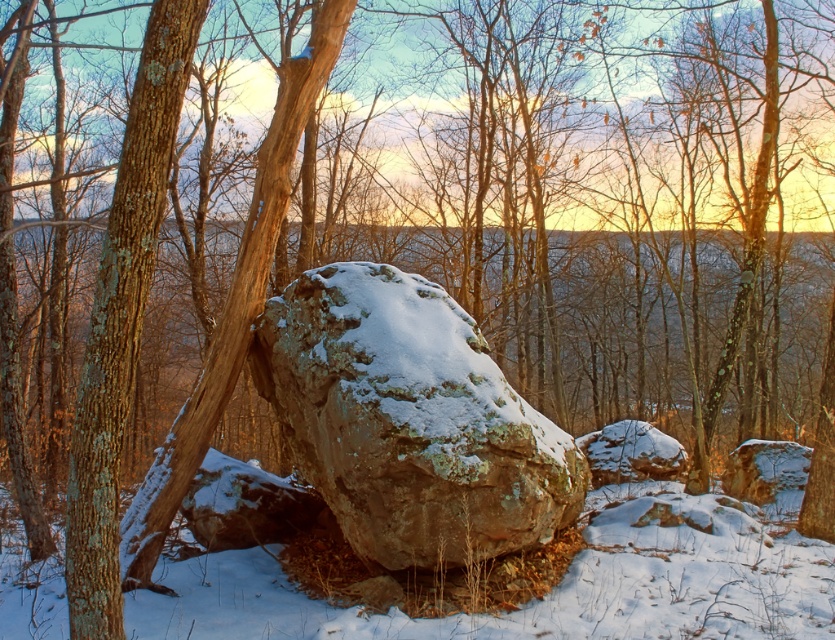
You are an explorer standing in the winter landscape and want to reach the smooth brown tree trunk at left. Which direction should you move relative to the snowy gray rock at center?

You should move away from the snowy gray rock at center towards the smooth brown tree trunk at left because the tree trunk is further away from you than the rock.

You are an outdoor photographer planning to take a photo of the snowy gray rock at center and the smooth brown tree trunk at left. You want to ensure both subjects are in focus. If your camera has a depth of field that can cover 3 meters, will both subjects be in focus?

The snowy gray rock at center is 2.85 meters away from the smooth brown tree trunk at left. Since the distance between them is within the 3 meter depth of field, both subjects will be in focus.

You are standing at the origin point in the image. Which direction should you move to reach the snowy gray rock at center?

The snowy gray rock at center is located at point 0.658 on the x axis and 0.491 on the y axis. Since you are at the origin point, you should move towards the right and slightly upwards to reach it.